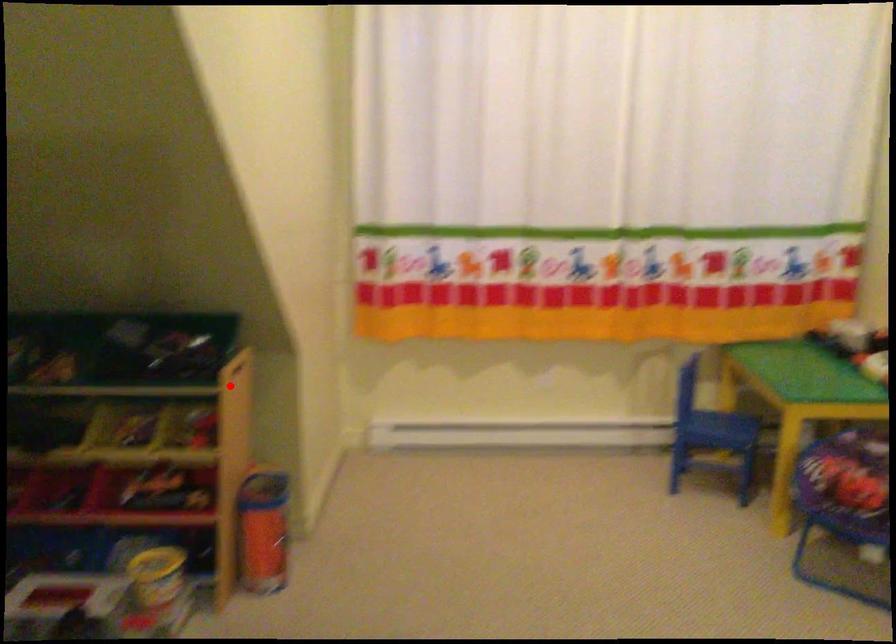
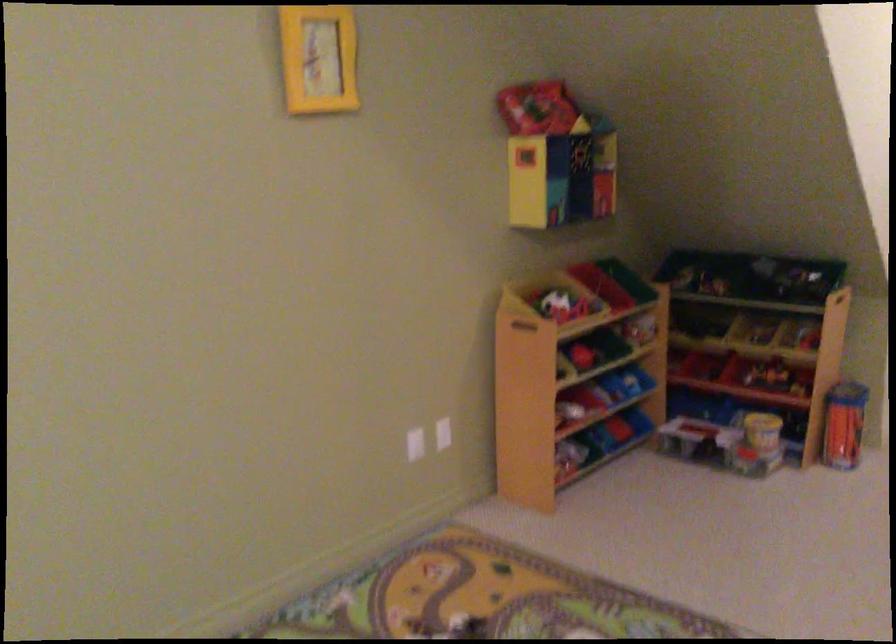
Question: A red point is marked in image1. In image2, is the corresponding 3D point closer to the camera or farther? Reply with the corresponding letter.

Choices:
 (A) The corresponding 3D point is closer.
 (B) The corresponding 3D point is farther.

Answer: (B)